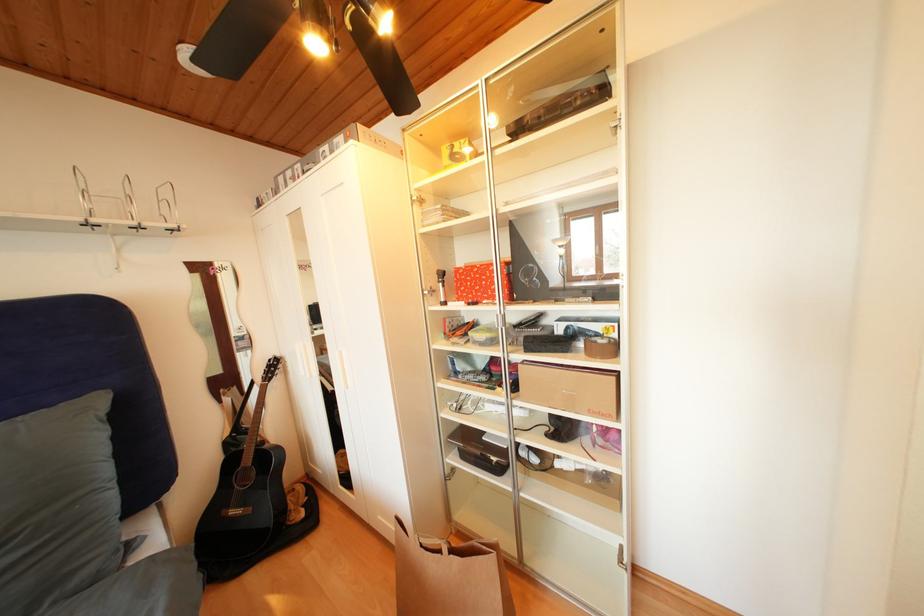
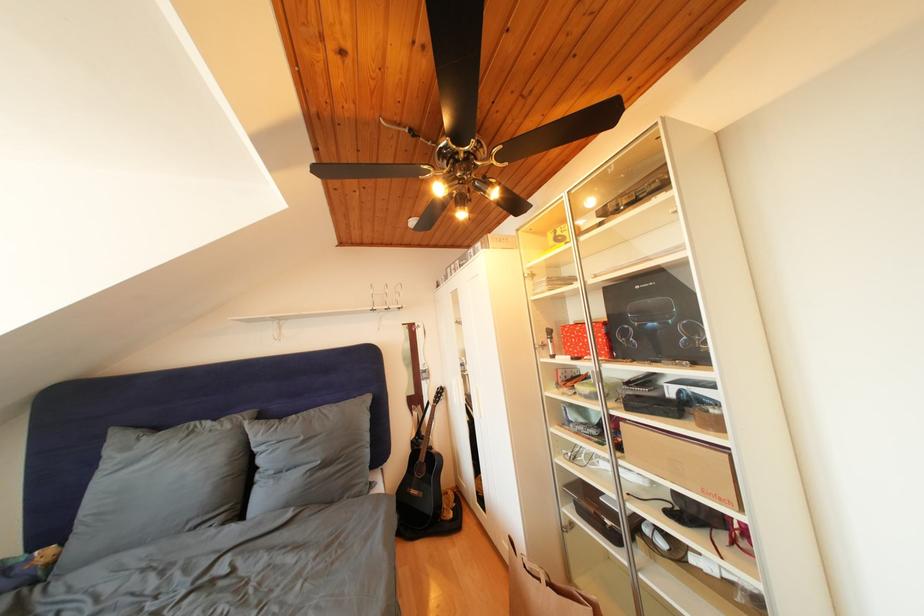
Find the pixel in the second image that matches (465,286) in the first image.

(572, 342)